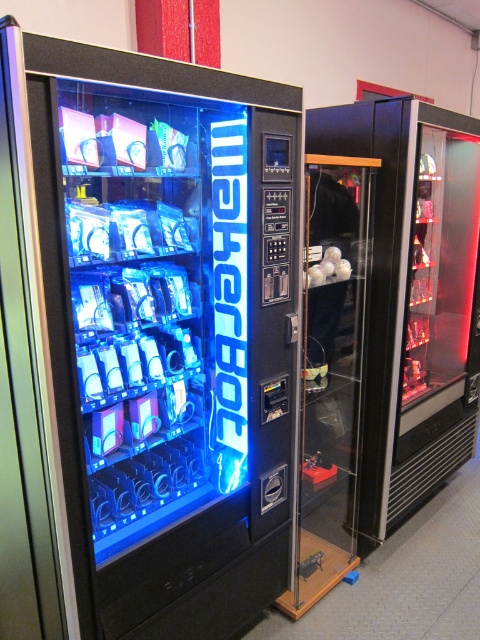
Question: Where is matte black vending machine at left located in relation to transparent glass beverage dispenser at right in the image?

Choices:
 (A) below
 (B) above

Answer: (A)

Question: Is matte black vending machine at left above transparent glass beverage dispenser at right?

Choices:
 (A) no
 (B) yes

Answer: (A)

Question: Can you confirm if matte black vending machine at left is smaller than transparent glass beverage dispenser at right?

Choices:
 (A) no
 (B) yes

Answer: (B)

Question: Which point appears closest to the camera in this image?

Choices:
 (A) (397, 243)
 (B) (50, 128)

Answer: (B)